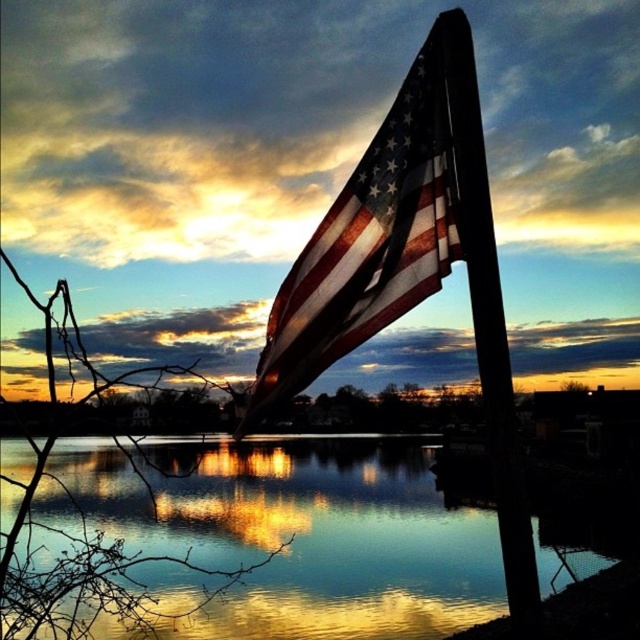
Does point (436, 80) lie in front of point (497, 275)?

No, it is not.

The image size is (640, 640). I want to click on worn fabric flag at upper center, so click(369, 243).

Where is `worn fabric flag at upper center`? worn fabric flag at upper center is located at coordinates (369, 243).

Find the location of a particular element. Image resolution: width=640 pixels, height=640 pixels. worn fabric flag at upper center is located at coordinates (369, 243).

Between reflective glass water at center and smooth wood flag pole at center, which one appears on the left side from the viewer's perspective?

Positioned to the left is reflective glass water at center.

Is reflective glass water at center above smooth wood flag pole at center?

Actually, reflective glass water at center is below smooth wood flag pole at center.

What do you see at coordinates (305, 536) in the screenshot? This screenshot has width=640, height=640. I see `reflective glass water at center` at bounding box center [305, 536].

Identify the location of reflective glass water at center. (305, 536).

Is reflective glass water at center positioned in front of worn fabric flag at upper center?

Yes, reflective glass water at center is in front of worn fabric flag at upper center.

Is point (228, 625) farther from viewer compared to point (412, 113)?

Yes, it is behind point (412, 113).

Does point (454, 525) come behind point (392, 124)?

Yes, it is behind point (392, 124).

This screenshot has width=640, height=640. Identify the location of reflective glass water at center. (305, 536).